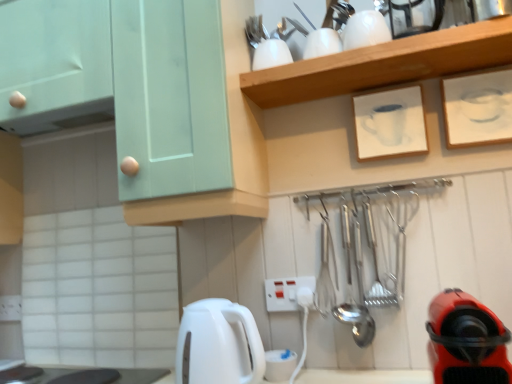
Question: Is red rubber vacuum cleaner at lower right far from white paper at upper right, the 1th picture frame positioned from the right?

Choices:
 (A) no
 (B) yes

Answer: (A)

Question: Is red rubber vacuum cleaner at lower right located outside white paper at upper right, which is counted as the second picture frame, starting from the left?

Choices:
 (A) yes
 (B) no

Answer: (A)

Question: From the image's perspective, is red rubber vacuum cleaner at lower right over white paper at upper right, the 1th picture frame positioned from the right?

Choices:
 (A) no
 (B) yes

Answer: (A)

Question: From the image's perspective, is red rubber vacuum cleaner at lower right located beneath white paper at upper right, the 1th picture frame positioned from the right?

Choices:
 (A) yes
 (B) no

Answer: (A)

Question: Is red rubber vacuum cleaner at lower right closer to camera compared to white paper at upper right, the 1th picture frame positioned from the right?

Choices:
 (A) no
 (B) yes

Answer: (B)

Question: Is point (148, 375) positioned closer to the camera than point (478, 77)?

Choices:
 (A) closer
 (B) farther

Answer: (B)

Question: Is black glossy countertop at lower left wider or thinner than white paper at upper right, the 1th picture frame positioned from the right?

Choices:
 (A) wide
 (B) thin

Answer: (A)

Question: Is black glossy countertop at lower left to the left or to the right of white paper at upper right, the 1th picture frame positioned from the right, in the image?

Choices:
 (A) right
 (B) left

Answer: (B)

Question: Considering the positions of black glossy countertop at lower left and white paper at upper right, the 1th picture frame positioned from the right, in the image, is black glossy countertop at lower left bigger or smaller than white paper at upper right, the 1th picture frame positioned from the right,?

Choices:
 (A) big
 (B) small

Answer: (A)

Question: From the image's perspective, is white glossy cups at upper center positioned above or below white matte picture frame at upper center, the second picture frame in the right-to-left sequence?

Choices:
 (A) below
 (B) above

Answer: (B)

Question: In terms of width, does white glossy cups at upper center look wider or thinner when compared to white matte picture frame at upper center, acting as the 1th picture frame starting from the left?

Choices:
 (A) wide
 (B) thin

Answer: (A)

Question: From a real-world perspective, is white glossy cups at upper center physically located above or below white matte picture frame at upper center, acting as the 1th picture frame starting from the left?

Choices:
 (A) below
 (B) above

Answer: (B)

Question: Is white glossy cups at upper center bigger or smaller than white matte picture frame at upper center, the second picture frame in the right-to-left sequence?

Choices:
 (A) small
 (B) big

Answer: (B)

Question: Is white matte picture frame at upper center, acting as the 1th picture frame starting from the left, situated inside black glossy countertop at lower left or outside?

Choices:
 (A) outside
 (B) inside

Answer: (A)

Question: In terms of width, does white matte picture frame at upper center, the second picture frame in the right-to-left sequence, look wider or thinner when compared to black glossy countertop at lower left?

Choices:
 (A) thin
 (B) wide

Answer: (A)